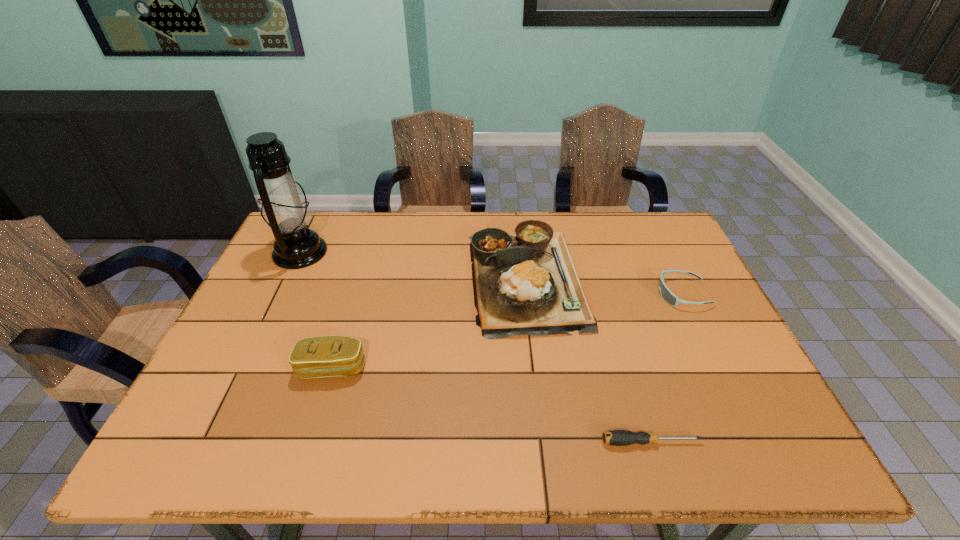
Find the location of a particular element. object that is positioned at the right edge is located at coordinates (666, 294).

This screenshot has width=960, height=540. What are the coordinates of `object that is at the far left corner` in the screenshot? It's located at (285, 210).

This screenshot has width=960, height=540. I want to click on blank area at the far edge, so click(x=337, y=237).

At what (x,y) coordinates should I click in order to perform the action: click on blank space at the near edge. Please return your answer as a coordinate pair (x, y). Image resolution: width=960 pixels, height=540 pixels. Looking at the image, I should click on (613, 428).

The width and height of the screenshot is (960, 540). I want to click on vacant region at the left edge, so click(x=289, y=280).

In the image, there is a desktop. Where is `vacant space at the right edge`? The image size is (960, 540). vacant space at the right edge is located at coordinates (708, 359).

Locate an element on the screen. free space between the fourth farthest object and the screwdriver is located at coordinates (492, 405).

Where is `unoccupied position between the platter and the oil lamp`? The height and width of the screenshot is (540, 960). unoccupied position between the platter and the oil lamp is located at coordinates (413, 266).

Locate an element on the screen. unoccupied area between the leftmost object and the platter is located at coordinates (413, 266).

The image size is (960, 540). I want to click on empty space between the screwdriver and the second object from left to right, so click(x=492, y=405).